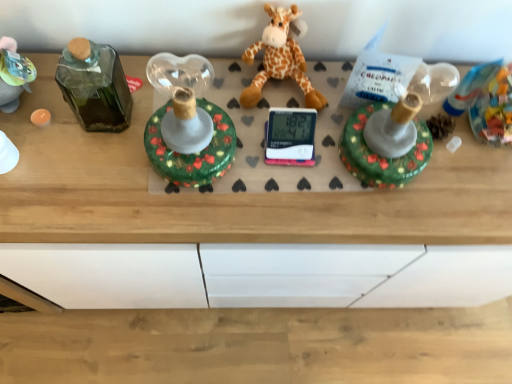
Where is `vacant area that lies to the right of shiny green glass candlestick at center`? This screenshot has width=512, height=384. vacant area that lies to the right of shiny green glass candlestick at center is located at coordinates (276, 180).